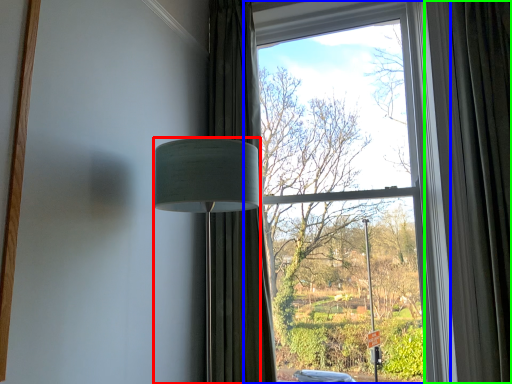
Question: Considering the real-world distances, which object is farthest from lamp (highlighted by a red box)? window (highlighted by a blue box) or curtain (highlighted by a green box)?

Choices:
 (A) window
 (B) curtain

Answer: (A)